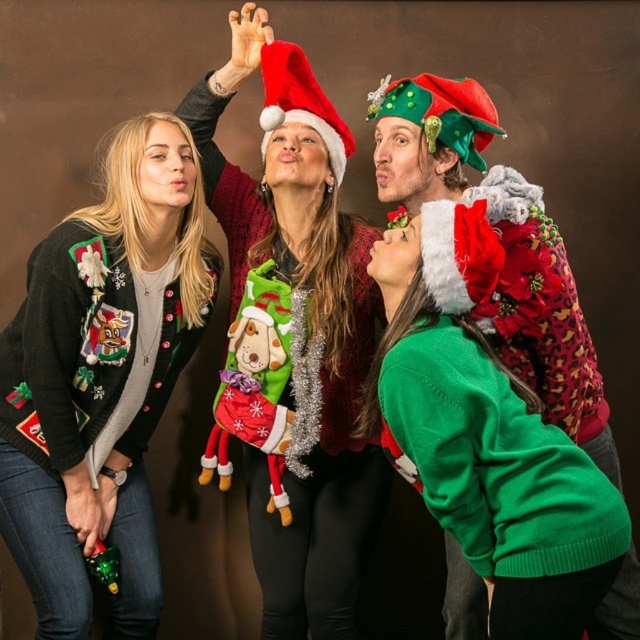
Question: Can you confirm if fuzzy red santa hat at center is positioned above green felt christmas hat at upper center?

Choices:
 (A) no
 (B) yes

Answer: (A)

Question: Which point is closer to the camera?

Choices:
 (A) fuzzy red santa hat at center
 (B) matte black sweater at left
 (C) red velvet santa hat at center
 (D) green fuzzy sweater at center

Answer: (D)

Question: Among these points, which one is farthest from the camera?

Choices:
 (A) (272, 61)
 (B) (93, 330)

Answer: (A)

Question: From the image, what is the correct spatial relationship of fuzzy red santa hat at center in relation to matte black sweater at left?

Choices:
 (A) below
 (B) above

Answer: (B)

Question: Does green fuzzy sweater at center have a larger size compared to green felt christmas hat at upper center?

Choices:
 (A) yes
 (B) no

Answer: (A)

Question: Which object appears closest to the camera in this image?

Choices:
 (A) green fuzzy sweater at center
 (B) fuzzy red santa hat at center
 (C) matte black sweater at left

Answer: (A)